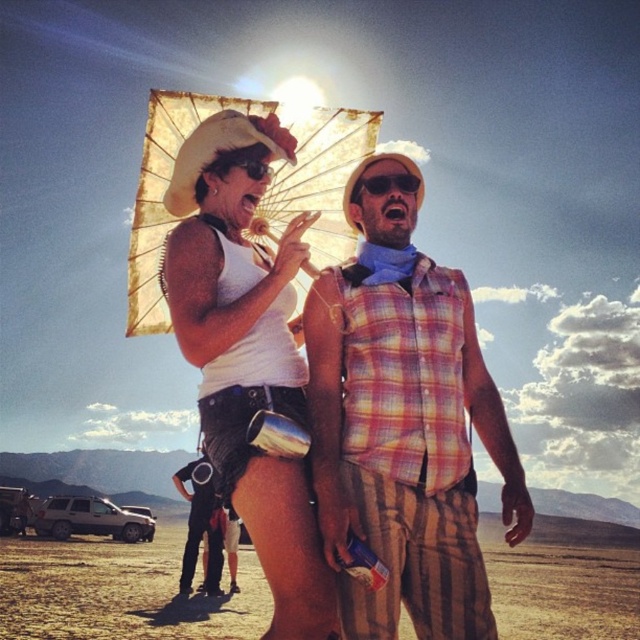
Based on the scene description, where is the dirt field at lower center located in relation to the gold paper parasol at upper center?

The dirt field at lower center is located to the right of the gold paper parasol at upper center.

Based on the scene description, where is the matte white umbrella at upper center located in terms of coordinates?

The matte white umbrella at upper center is located at coordinates 0.550 in the x axis and 0.388 in the y axis.